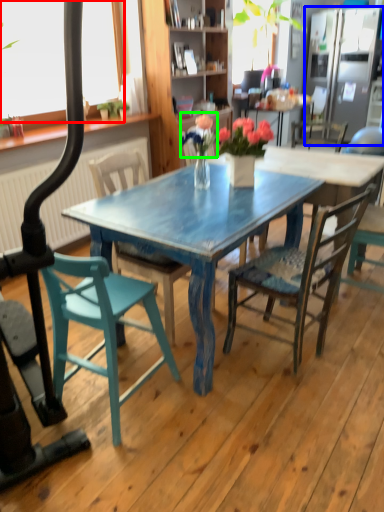
Question: Which object is the closest to the window screen (highlighted by a red box)? Choose among these: refrigerator (highlighted by a blue box) or flower (highlighted by a green box).

Choices:
 (A) refrigerator
 (B) flower

Answer: (B)